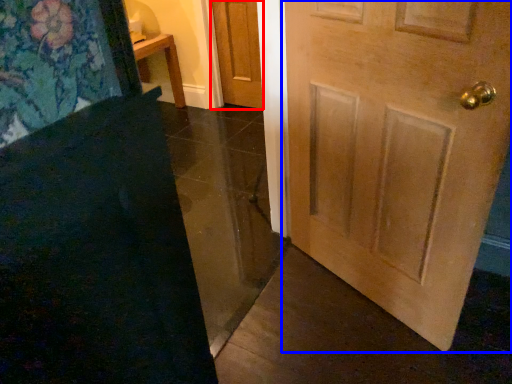
Question: Among these objects, which one is nearest to the camera, door (highlighted by a red box) or door (highlighted by a blue box)?

Choices:
 (A) door
 (B) door

Answer: (B)